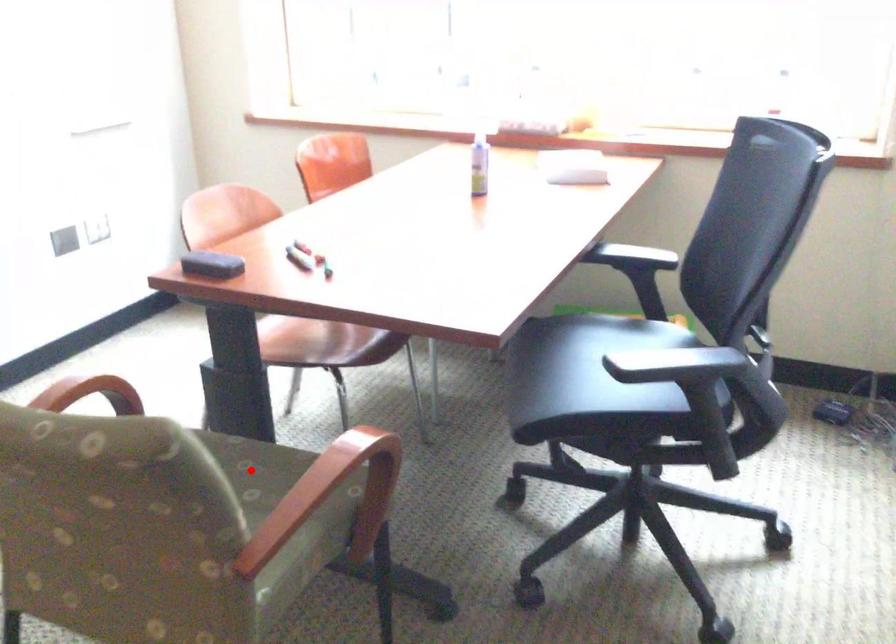
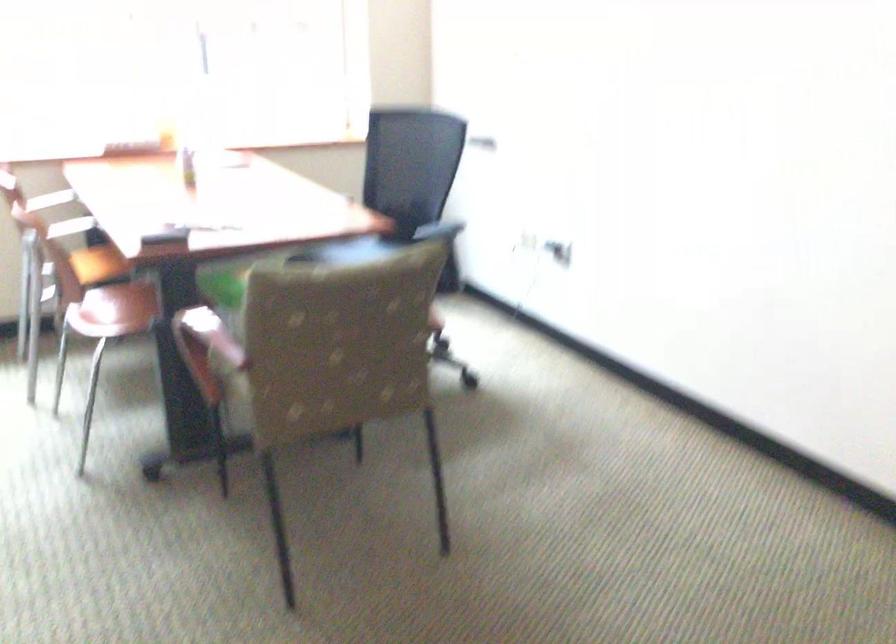
Question: I am providing you with two images of the same scene from different viewpoints. A red point is marked on the first image. At the location where the point appears in image 1, is it still visible in image 2?

Choices:
 (A) Yes
 (B) No

Answer: (B)